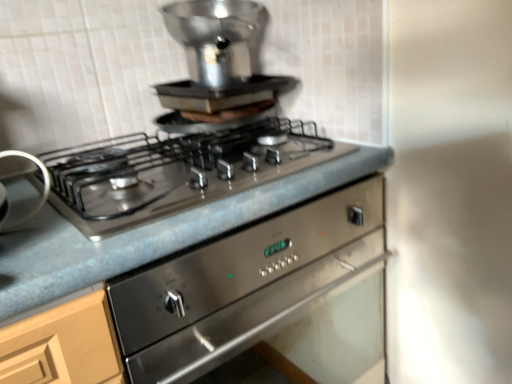
Identify the location of vacant space to the right of satin silver burner at left, placed as the 1th appliance when sorted from left to right. (108, 210).